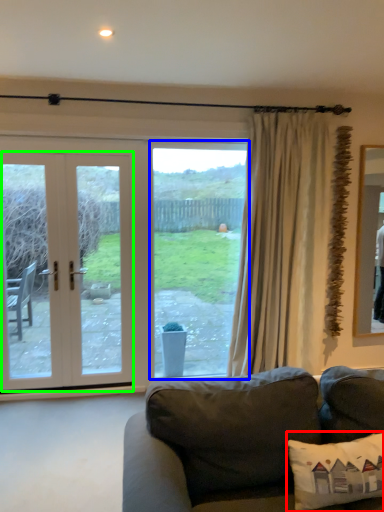
Question: Considering the real-world distances, which object is farthest from pillow (highlighted by a red box)? window (highlighted by a blue box) or door (highlighted by a green box)?

Choices:
 (A) window
 (B) door

Answer: (B)